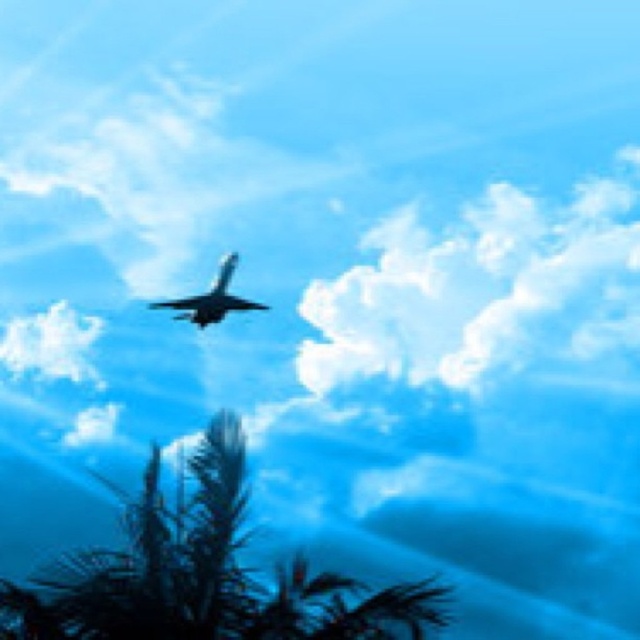
Does white fluffy cloud at upper center come behind green leafy tree at lower center?

Yes, white fluffy cloud at upper center is behind green leafy tree at lower center.

The height and width of the screenshot is (640, 640). In order to click on white fluffy cloud at upper center in this screenshot , I will do `click(484, 289)`.

What are the coordinates of `white fluffy cloud at upper center` in the screenshot? It's located at (484, 289).

Between green leafy tree at lower center and shiny silver airplane at center, which one appears on the left side from the viewer's perspective?

shiny silver airplane at center

Between green leafy tree at lower center and shiny silver airplane at center, which one has less height?

green leafy tree at lower center is shorter.

Who is more distant from viewer, (244, 625) or (205, 292)?

Positioned behind is point (205, 292).

You are a GUI agent. You are given a task and a screenshot of the screen. Output one action in this format:
    pyautogui.click(x=<x>, y=<y>)
    Task: Click on the green leafy tree at lower center
    The height and width of the screenshot is (640, 640).
    Given the screenshot: What is the action you would take?
    pyautogui.click(x=202, y=573)

What do you see at coordinates (484, 289) in the screenshot? I see `white fluffy cloud at upper center` at bounding box center [484, 289].

Find the location of a particular element. The width and height of the screenshot is (640, 640). white fluffy cloud at upper center is located at coordinates (484, 289).

Which is in front, point (548, 262) or point (170, 308)?

Positioned in front is point (548, 262).

I want to click on white fluffy cloud at upper center, so click(484, 289).